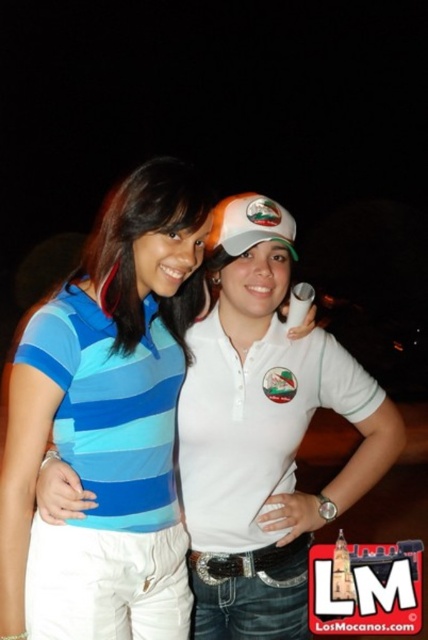
You are a photographer trying to capture a clear photo of the white matte polo shirt at center and the blue striped polo shirt at center. Since the scene is dark, you need to adjust your camera focus. Which shirt should you focus on first to ensure both are in focus?

The white matte polo shirt at center is behind the blue striped polo shirt at center, so you should focus on the blue striped polo shirt at center first to ensure both are in focus.

Looking at this image, you are a photographer trying to capture a photo of both the blue striped polo shirt at center and the white matte polo shirt at center. Since the scene is dark, you need to adjust your camera focus. Which of the two should you focus on first to ensure both are in focus, considering their positions?

The blue striped polo shirt at center is located below the white matte polo shirt at center. To ensure both are in focus, focus on the white matte polo shirt at center first since it is closer to the camera, and the blue striped polo shirt at center will naturally fall into the depth of field.

Based on the scene description, where is the blue striped polo shirt at left positioned in terms of coordinates?

The blue striped polo shirt at left is positioned at coordinates 0.637 on the x axis and 0.262 on the y axis.